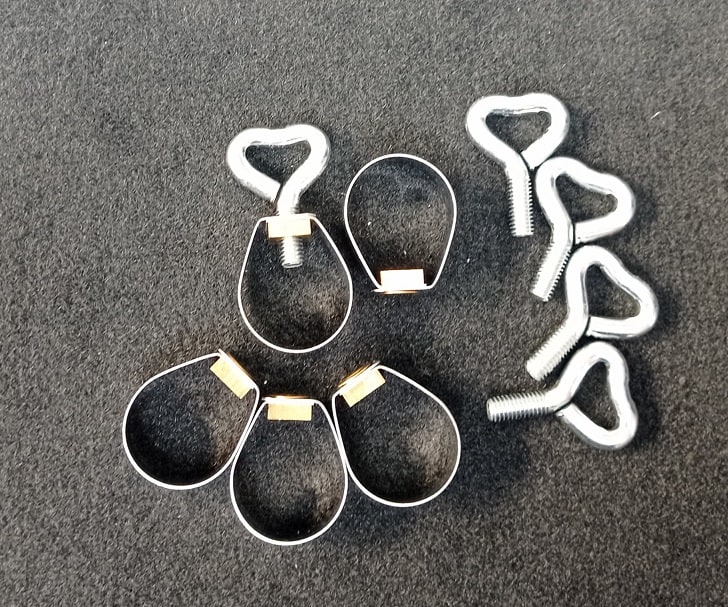
Where is `screw holder`? The width and height of the screenshot is (728, 607). screw holder is located at coordinates (343, 328), (446, 181), (451, 476), (330, 529), (142, 462).